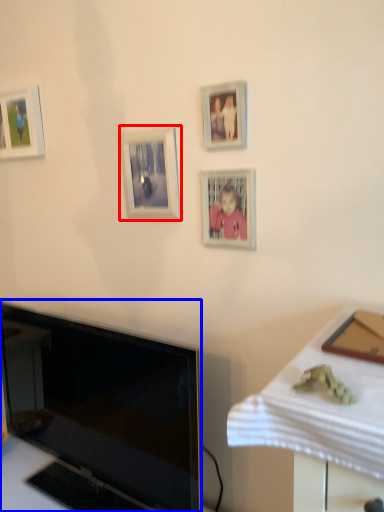
Question: Which of the following is the farthest to the observer, picture frame (highlighted by a red box) or television (highlighted by a blue box)?

Choices:
 (A) picture frame
 (B) television

Answer: (A)